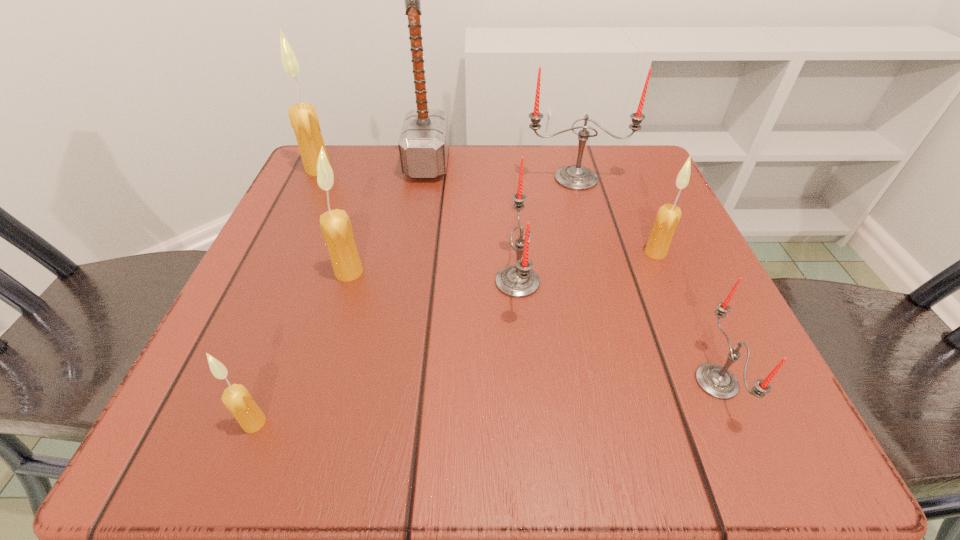
Choose which candle is the fifth nearest neighbor to the biggest red candle. Please provide its 2D coordinates. Your answer should be formatted as a tuple, i.e. [(x, y)], where the tuple contains the x and y coordinates of a point satisfying the conditions above.

[(303, 117)]

Find the location of a particular element. The height and width of the screenshot is (540, 960). cream candle that is the second nearest to the leftmost cream candle is located at coordinates (236, 398).

The height and width of the screenshot is (540, 960). Identify the location of cream candle that is the closest to the second nearest red candle. (667, 219).

Identify which red candle is the nearest to the nearest red candle. Please provide its 2D coordinates. Your answer should be formatted as a tuple, i.e. [(x, y)], where the tuple contains the x and y coordinates of a point satisfying the conditions above.

[(518, 281)]

This screenshot has height=540, width=960. In order to click on red candle identified as the second closest to the tallest object in this screenshot , I will do click(518, 281).

Locate an element on the screen. The image size is (960, 540). free space that satisfies the following two spatial constraints: 1. on the front side of the tallest candle; 2. on the left side of the smallest cream candle is located at coordinates (196, 423).

Find the location of `free space that satisfies the following two spatial constraints: 1. on the front side of the rightmost cream candle; 2. on the front-facing side of the second nearest red candle`. free space that satisfies the following two spatial constraints: 1. on the front side of the rightmost cream candle; 2. on the front-facing side of the second nearest red candle is located at coordinates (668, 282).

This screenshot has height=540, width=960. What are the coordinates of `vacant space that satisfies the following two spatial constraints: 1. on the front-facing side of the biggest red candle; 2. on the front-facing side of the second smallest red candle` in the screenshot? It's located at (605, 282).

Where is `vacant space that satisfies the following two spatial constraints: 1. on the front-facing side of the biggest red candle; 2. on the front-facing side of the second biggest red candle`? vacant space that satisfies the following two spatial constraints: 1. on the front-facing side of the biggest red candle; 2. on the front-facing side of the second biggest red candle is located at coordinates pos(605,282).

Locate an element on the screen. vacant region that satisfies the following two spatial constraints: 1. on the front side of the nearest cream candle; 2. on the right side of the leftmost candle is located at coordinates (196, 423).